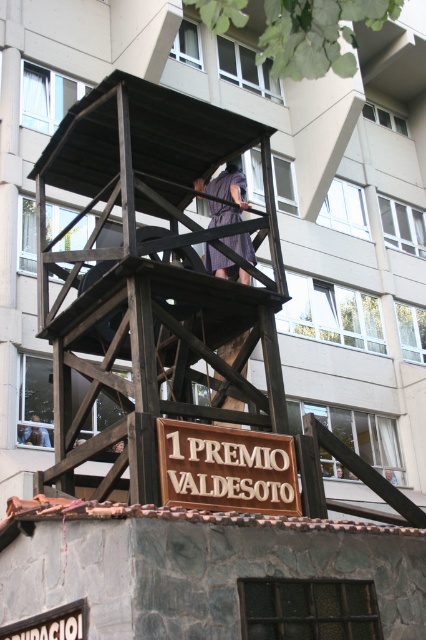
Between wooden scaffolding at center and dark purple dress at center, which one appears on the right side from the viewer's perspective?

dark purple dress at center is more to the right.

Who is taller, wooden scaffolding at center or dark purple dress at center?

Standing taller between the two is wooden scaffolding at center.

This screenshot has height=640, width=426. I want to click on wooden scaffolding at center, so click(x=150, y=276).

Can you confirm if brown wooden sign at center is wider than dark purple dress at center?

Correct, the width of brown wooden sign at center exceeds that of dark purple dress at center.

Between brown wooden sign at center and dark purple dress at center, which one appears on the right side from the viewer's perspective?

dark purple dress at center is more to the right.

Is point (233, 504) more distant than point (207, 248)?

No, it is not.

Locate an element on the screen. brown wooden sign at center is located at coordinates (227, 468).

Can you confirm if brown wooden sign at center is bigger than dark brown wooden figure at center?

Yes.

Between point (201, 454) and point (42, 442), which one is positioned behind?

Positioned behind is point (42, 442).

Is point (262, 438) less distant than point (25, 435)?

Yes, it is in front of point (25, 435).

The width and height of the screenshot is (426, 640). In order to click on brown wooden sign at center in this screenshot , I will do `click(227, 468)`.